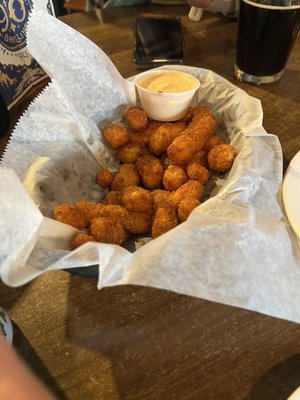
Where is `piece of paper`? This screenshot has width=300, height=400. piece of paper is located at coordinates (18, 65).